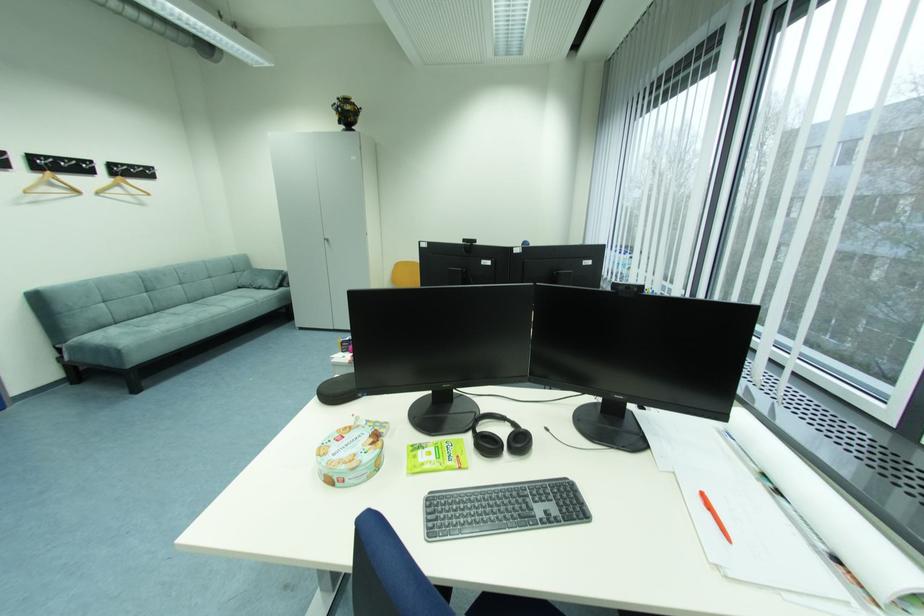
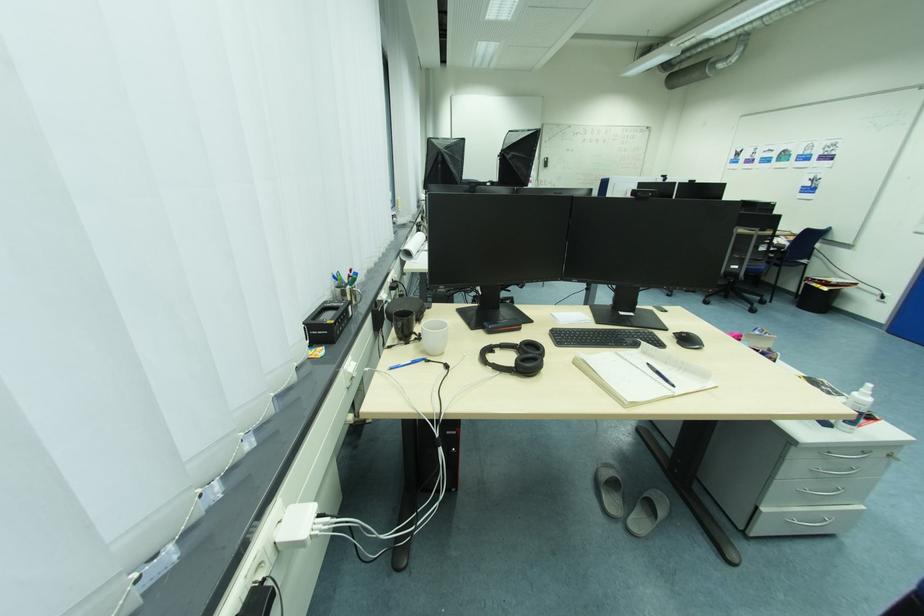
Question: I am providing you with two images of the same scene from different viewpoints. Please identify which objects are invisible in image2.

Choices:
 (A) orange pen
 (B) white pot lid
 (C) black computer mouse
 (D) black mug

Answer: (A)